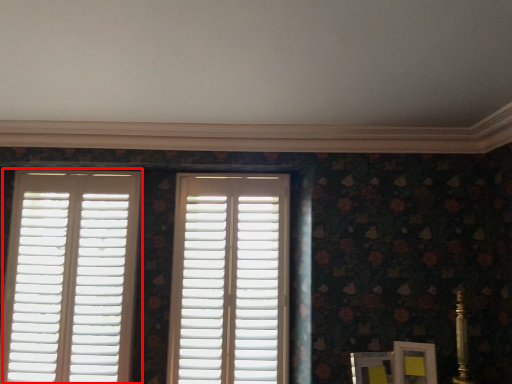
Question: From the image, what is the correct spatial relationship of window (annotated by the red box) in relation to window?

Choices:
 (A) right
 (B) left

Answer: (B)